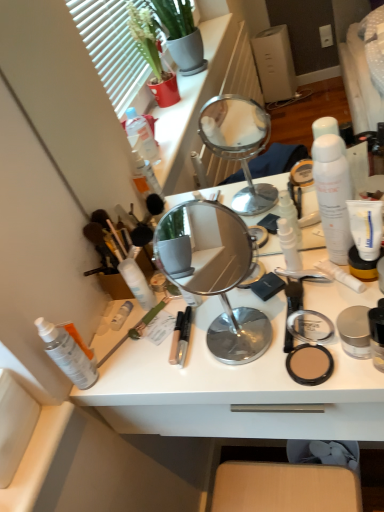
At what (x,y) coordinates should I click in order to perform the action: click on free area in between transparent plastic spray bottle at lower left, the 1th toiletry from the left, and white matte lotion at center, the 5th toiletry when ordered from left to right. Please return your answer as a coordinate pair (x, y). The height and width of the screenshot is (512, 384). Looking at the image, I should click on (191, 326).